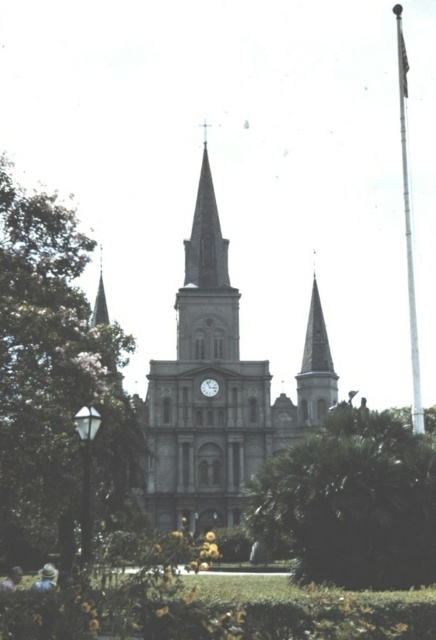
Question: Does green leafy tree at center appear under metallic gray clock at center?

Choices:
 (A) no
 (B) yes

Answer: (B)

Question: Considering the real-world distances, which object is closest to the green leafy tree at left?

Choices:
 (A) brown stone church at center
 (B) green leafy tree at center
 (C) metallic gray clock at center
 (D) smooth stone steeple at center

Answer: (A)

Question: Which object is closer to the camera taking this photo?

Choices:
 (A) brown stone church at center
 (B) smooth stone steeple at center
 (C) metallic gray clock at center

Answer: (A)

Question: Observing the image, what is the correct spatial positioning of green leafy tree at left in reference to smooth stone steeple at center?

Choices:
 (A) right
 (B) left

Answer: (B)

Question: Does green leafy tree at left appear on the right side of metallic gray clock at center?

Choices:
 (A) no
 (B) yes

Answer: (A)

Question: Among these objects, which one is farthest from the camera?

Choices:
 (A) smooth stone steeple at center
 (B) green leafy tree at left

Answer: (A)